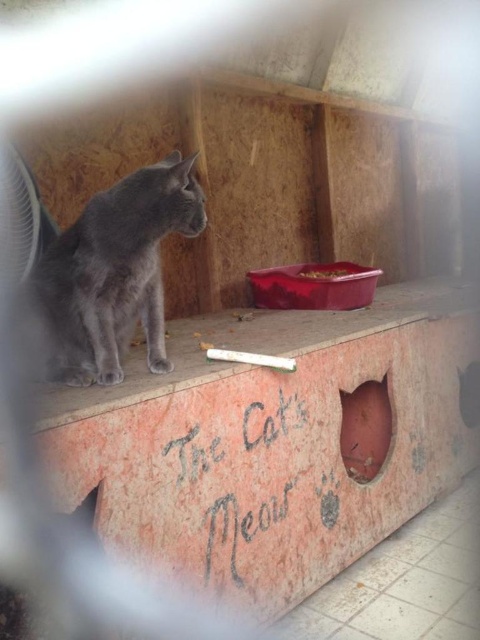
Question: Which object is farther from the camera taking this photo?

Choices:
 (A) gray chalk writing at center
 (B) rustic concrete ledge at center
 (C) matte gray cat at center

Answer: (C)

Question: Among these points, which one is nearest to the camera?

Choices:
 (A) (178, 481)
 (B) (240, 358)
 (C) (151, 241)
 (D) (330, 356)

Answer: (A)

Question: Considering the real-world distances, which object is closest to the gray chalk writing at center?

Choices:
 (A) white matte cigarette at center
 (B) rustic concrete ledge at center
 (C) matte gray cat at center

Answer: (B)

Question: Is matte gray cat at center below gray chalk writing at center?

Choices:
 (A) no
 (B) yes

Answer: (A)

Question: Is rustic concrete ledge at center thinner than white matte cigarette at center?

Choices:
 (A) no
 (B) yes

Answer: (A)

Question: Is gray chalk writing at center to the left of white matte cigarette at center from the viewer's perspective?

Choices:
 (A) yes
 (B) no

Answer: (A)